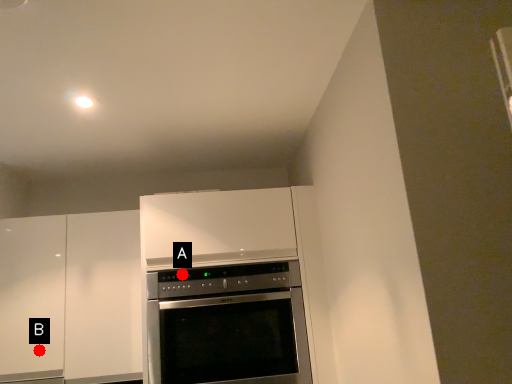
Question: Two points are circled on the image, labeled by A and B beside each circle. Which point is closer to the camera?

Choices:
 (A) A is closer
 (B) B is closer

Answer: (A)